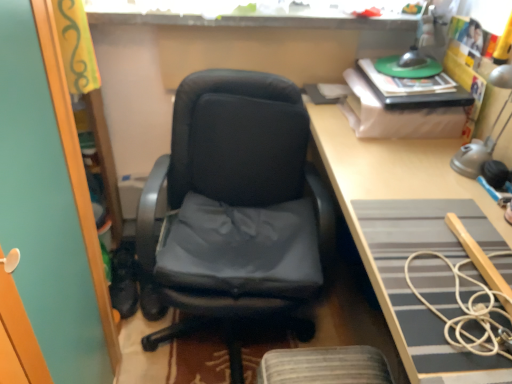
In order to click on free point above white cord at right (from a real-world perspective) in this screenshot , I will do `click(476, 302)`.